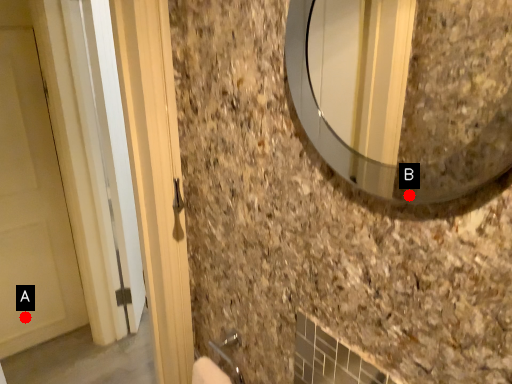
Question: Two points are circled on the image, labeled by A and B beside each circle. Among these points, which one is farthest from the camera?

Choices:
 (A) A is further
 (B) B is further

Answer: (A)